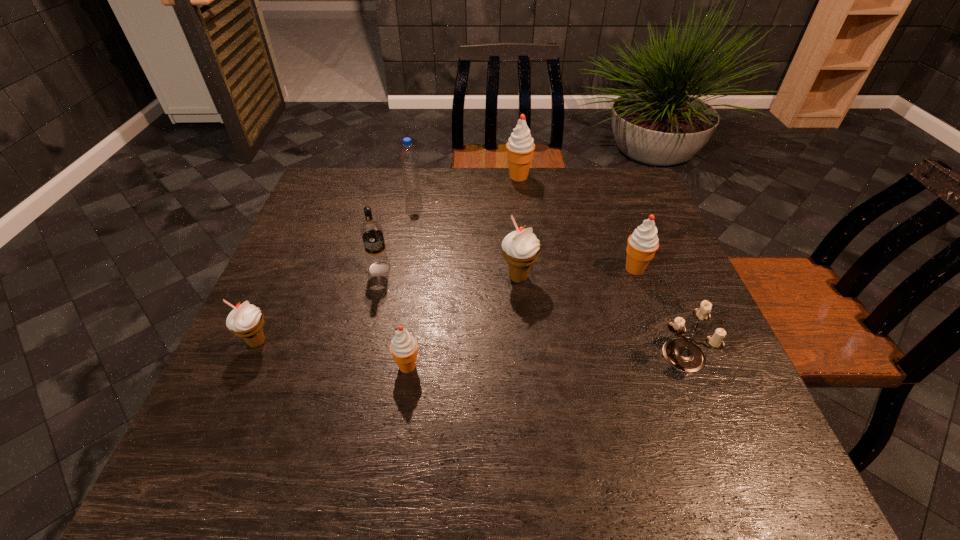
Locate an element on the screen. Image resolution: width=960 pixels, height=540 pixels. vacant space at the far right corner of the desktop is located at coordinates (640, 200).

The image size is (960, 540). I want to click on free space that is in between the left white icecream and the fifth object from right to left, so click(332, 354).

Identify the location of vacant area that lies between the farther white icecream and the seventh nearest object. (466, 237).

Find the location of a particular element. free space between the vodka and the smallest red icecream is located at coordinates (394, 317).

You are a GUI agent. You are given a task and a screenshot of the screen. Output one action in this format:
    pyautogui.click(x=<x>, y=<y>)
    Task: Click on the free area in between the vodka and the candle holder
    The image size is (960, 540).
    Given the screenshot: What is the action you would take?
    pyautogui.click(x=530, y=312)

Find the location of a particular element. free area in between the bigger white icecream and the vodka is located at coordinates pyautogui.click(x=449, y=273).

The width and height of the screenshot is (960, 540). Find the location of `vacant area that lies between the left white icecream and the smallest red icecream`. vacant area that lies between the left white icecream and the smallest red icecream is located at coordinates (332, 354).

I want to click on free spot between the smallest red icecream and the bigger white icecream, so click(x=463, y=322).

The width and height of the screenshot is (960, 540). I want to click on blank region between the farther white icecream and the candle holder, so click(599, 316).

You are a GUI agent. You are given a task and a screenshot of the screen. Output one action in this format:
    pyautogui.click(x=<x>, y=<y>)
    Task: Click on the free spot between the vodka and the candle holder
    
    Given the screenshot: What is the action you would take?
    pyautogui.click(x=530, y=312)